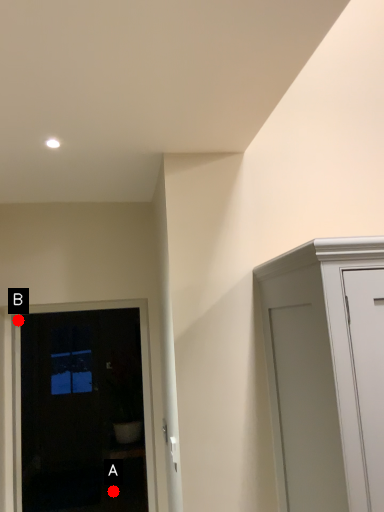
Question: Two points are circled on the image, labeled by A and B beside each circle. Which of the following is the farthest from the observer?

Choices:
 (A) A is further
 (B) B is further

Answer: (A)